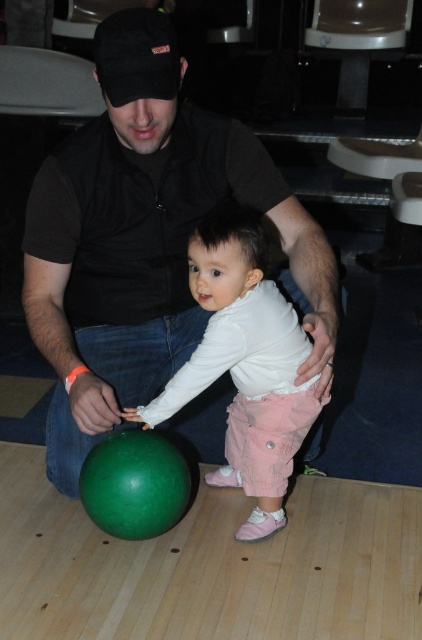
Question: Does black matte shirt at center have a lesser width compared to matte white shirt at center?

Choices:
 (A) yes
 (B) no

Answer: (B)

Question: Is black matte shirt at center positioned in front of matte white shirt at center?

Choices:
 (A) yes
 (B) no

Answer: (A)

Question: Which of the following is the closest to the observer?

Choices:
 (A) (265, 374)
 (B) (138, 381)

Answer: (A)

Question: Does black matte shirt at center appear under matte white shirt at center?

Choices:
 (A) yes
 (B) no

Answer: (B)

Question: Among these points, which one is farthest from the camera?

Choices:
 (A) (291, 426)
 (B) (148, 225)

Answer: (B)